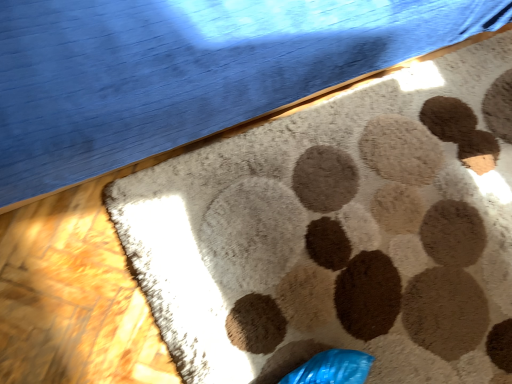
Identify the location of beige carpet at center. Image resolution: width=512 pixels, height=384 pixels. (186, 70).

Image resolution: width=512 pixels, height=384 pixels. Describe the element at coordinates (186, 70) in the screenshot. I see `beige carpet at center` at that location.

What do you see at coordinates (338, 233) in the screenshot? This screenshot has height=384, width=512. I see `beige textured rug at center` at bounding box center [338, 233].

This screenshot has width=512, height=384. Identify the location of beige textured rug at center. (338, 233).

You are a GUI agent. You are given a task and a screenshot of the screen. Output one action in this format:
    pyautogui.click(x=<x>, y=<y>)
    Task: Click on the beige carpet at center
    This screenshot has width=512, height=384.
    Given the screenshot: What is the action you would take?
    pyautogui.click(x=186, y=70)

Between beige textured rug at center and beige carpet at center, which one appears on the right side from the viewer's perspective?

From the viewer's perspective, beige textured rug at center appears more on the right side.

In the scene shown: Is the position of beige textured rug at center more distant than that of beige carpet at center?

Yes.

Which is behind, point (398, 235) or point (306, 13)?

The point (398, 235) is farther from the camera.

Based on the photo, from the image's perspective, which is above, beige textured rug at center or beige carpet at center?

beige carpet at center.

From a real-world perspective, who is located lower, beige textured rug at center or beige carpet at center?

From a 3D spatial view, beige textured rug at center is below.

Considering the relative sizes of beige textured rug at center and beige carpet at center in the image provided, is beige textured rug at center wider than beige carpet at center?

Yes, beige textured rug at center is wider than beige carpet at center.

Considering the relative sizes of beige textured rug at center and beige carpet at center in the image provided, is beige textured rug at center taller than beige carpet at center?

Result: In fact, beige textured rug at center may be shorter than beige carpet at center.

Considering the sizes of beige textured rug at center and beige carpet at center in the image, is beige textured rug at center bigger or smaller than beige carpet at center?

Clearly, beige textured rug at center is smaller in size than beige carpet at center.

Is beige textured rug at center not inside beige carpet at center?

Yes.

Is beige textured rug at center far from beige carpet at center?

Actually, beige textured rug at center and beige carpet at center are a little close together.

Is beige textured rug at center oriented towards beige carpet at center?

No, beige textured rug at center is not turned towards beige carpet at center.

How much distance is there between beige textured rug at center and beige carpet at center?

beige textured rug at center is 14.08 inches away from beige carpet at center.

Identify the location of furniture on the left of the beige textured rug at center. (186, 70).

Which is more to the right, beige carpet at center or beige textured rug at center?

beige textured rug at center.

Does beige carpet at center lie in front of beige textured rug at center?

That is True.

Is point (334, 40) behind point (344, 282)?

That is False.

From the picture: From the image's perspective, between beige carpet at center and beige textured rug at center, who is located below?

beige textured rug at center is shown below in the image.

From a real-world perspective, between beige carpet at center and beige textured rug at center, who is vertically lower?

beige textured rug at center is physically lower.

Looking at their sizes, would you say beige carpet at center is wider or thinner than beige textured rug at center?

Clearly, beige carpet at center has less width compared to beige textured rug at center.

Which of these two, beige carpet at center or beige textured rug at center, stands shorter?

Standing shorter between the two is beige textured rug at center.

Who is bigger, beige carpet at center or beige textured rug at center?

beige carpet at center is bigger.

Can we say beige carpet at center lies outside beige textured rug at center?

Absolutely, beige carpet at center is external to beige textured rug at center.

Would you consider beige carpet at center to be distant from beige textured rug at center?

beige carpet at center is near beige textured rug at center, not far away.

Is beige carpet at center oriented towards beige textured rug at center?

Yes.

Find the location of `furniture above the beige textured rug at center (from a real-world perspective)`. furniture above the beige textured rug at center (from a real-world perspective) is located at coordinates (186, 70).

Locate an element on the screen. Image resolution: width=512 pixels, height=384 pixels. furniture in front of the beige textured rug at center is located at coordinates (186, 70).

Identify the location of mat that appears behind the beige carpet at center. (338, 233).